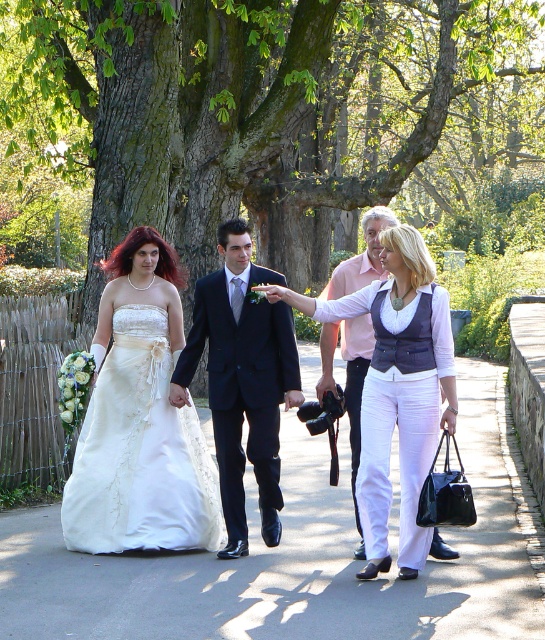
You are a photographer positioned at the entrance of the park. You need to capture a photo of the white satin dress at center and the dark blue suit at center. Based on their positions, which one should you focus on first to ensure both are in frame?

The white satin dress at center is in front of the dark blue suit at center, so you should focus on the dark blue suit at center first to ensure both are in frame.

You are a photographer positioned at the back of the group. You want to capture a photo where both the white satin dress at center and the dark blue suit at center are clearly visible. Given their sizes, which one might appear more prominent in the photo?

The white satin dress at center is larger in size than the dark blue suit at center, so it will appear more prominent in the photo.

You are a photographer positioned at the park entrance. You need to frame a shot that includes both the white satin dress at center and the dark blue suit at center. Which subject should you adjust your camera angle to accommodate better due to their size difference?

The white satin dress at center is wider than the dark blue suit at center, so you should adjust your camera angle to accommodate the wider white satin dress at center.